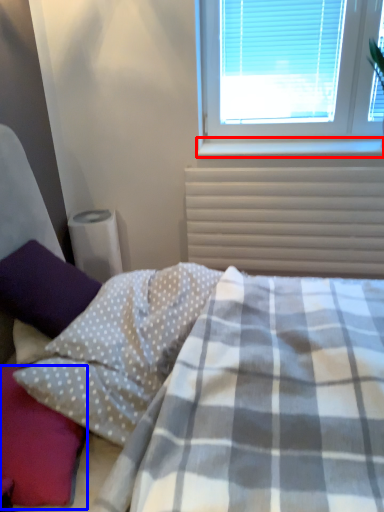
Question: Which of the following is the farthest to the observer, window sill (highlighted by a red box) or pillow (highlighted by a blue box)?

Choices:
 (A) window sill
 (B) pillow

Answer: (A)